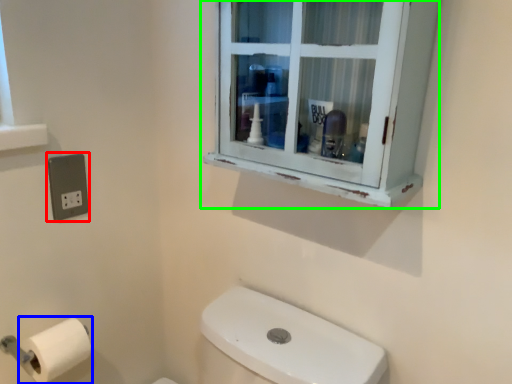
Question: Considering the real-world distances, which object is closest to electric outlet (highlighted by a red box)? toilet paper (highlighted by a blue box) or window (highlighted by a green box).

Choices:
 (A) toilet paper
 (B) window

Answer: (A)